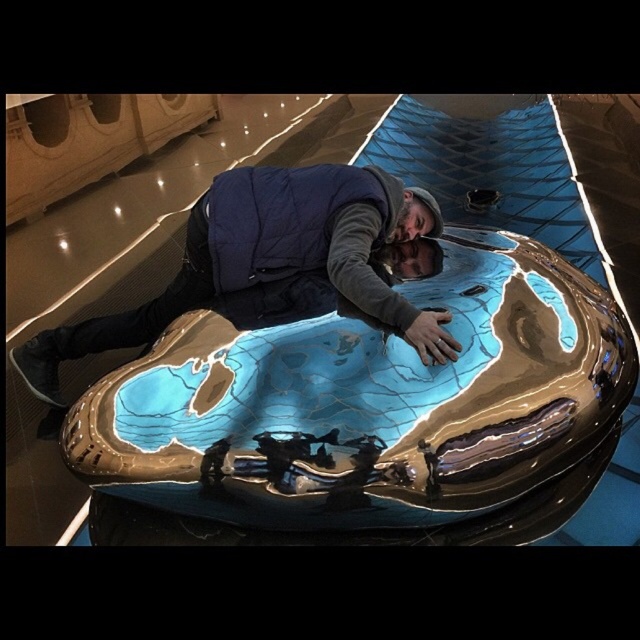
You are an art installer who needs to ensure the safety of the navy blue down vest at center and the metallic blue pool at center. Based on their positions, which object is more likely to be in contact with the floor?

The metallic blue pool at center is below the navy blue down vest at center, so the metallic blue pool at center is more likely to be in contact with the floor.

You are an interior designer assessing the space shown. You need to place a new decorative item that requires a surface area of 2 square meters. Which object between the metallic blue pool at center and the navy blue down vest at center would be suitable for placing the item?

The metallic blue pool at center is larger in size than the navy blue down vest at center, so it can accommodate the decorative item requiring 2 square meters.